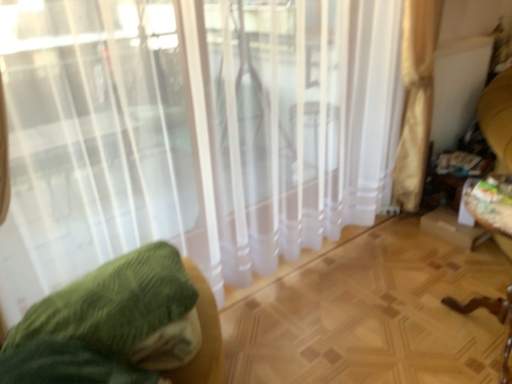
Question: Is green fabric cushion at left further to the viewer compared to white sheer curtain at center?

Choices:
 (A) no
 (B) yes

Answer: (B)

Question: Is green fabric cushion at left in contact with white sheer curtain at center?

Choices:
 (A) no
 (B) yes

Answer: (A)

Question: Is green fabric cushion at left aimed at white sheer curtain at center?

Choices:
 (A) no
 (B) yes

Answer: (A)

Question: Considering the relative positions of green fabric cushion at left and white sheer curtain at center in the image provided, is green fabric cushion at left to the left of white sheer curtain at center from the viewer's perspective?

Choices:
 (A) yes
 (B) no

Answer: (A)

Question: From a real-world perspective, is green fabric cushion at left physically below white sheer curtain at center?

Choices:
 (A) yes
 (B) no

Answer: (A)

Question: Considering the relative sizes of green fabric cushion at left and white sheer curtain at center in the image provided, is green fabric cushion at left smaller than white sheer curtain at center?

Choices:
 (A) no
 (B) yes

Answer: (B)

Question: Is green fabric cushion at left shorter than wooden swivel chair at right?

Choices:
 (A) no
 (B) yes

Answer: (B)

Question: Is green fabric cushion at left surrounding wooden swivel chair at right?

Choices:
 (A) no
 (B) yes

Answer: (A)

Question: Is green fabric cushion at left wider than wooden swivel chair at right?

Choices:
 (A) no
 (B) yes

Answer: (B)

Question: From a real-world perspective, is green fabric cushion at left physically above wooden swivel chair at right?

Choices:
 (A) no
 (B) yes

Answer: (A)

Question: Is green fabric cushion at left not near wooden swivel chair at right?

Choices:
 (A) no
 (B) yes

Answer: (B)

Question: From a real-world perspective, does green fabric cushion at left sit lower than wooden swivel chair at right?

Choices:
 (A) yes
 (B) no

Answer: (A)

Question: Is white sheer curtain at center positioned with its back to green fabric cushion at left?

Choices:
 (A) yes
 (B) no

Answer: (A)